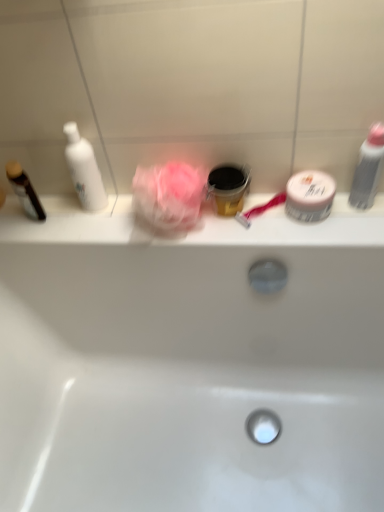
You are a GUI agent. You are given a task and a screenshot of the screen. Output one action in this format:
    pyautogui.click(x=<x>, y=<y>)
    Task: Click on the vacant region to the left of pink fabric rose at center
    This screenshot has width=384, height=512.
    Given the screenshot: What is the action you would take?
    pyautogui.click(x=91, y=223)